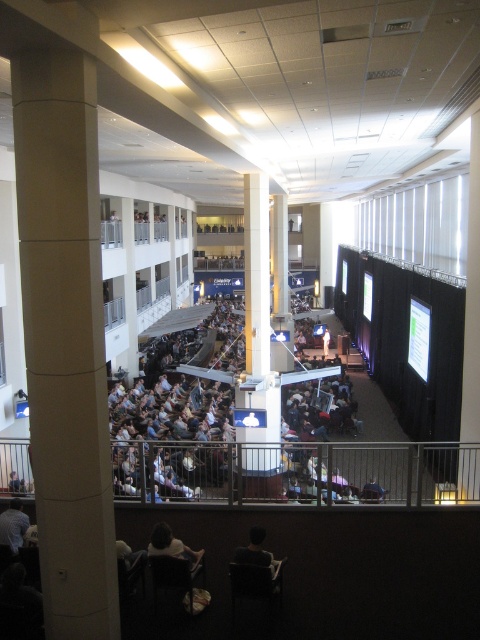
Question: Can you confirm if dark gray fabric crowd at center is positioned to the right of dark brown leather chair at lower center?

Choices:
 (A) no
 (B) yes

Answer: (A)

Question: Which object is farther from the camera taking this photo?

Choices:
 (A) light brown fabric shirt at lower left
 (B) dark brown hair at lower center

Answer: (A)

Question: Is dark gray fabric crowd at center smaller than dark brown hair at lower center?

Choices:
 (A) no
 (B) yes

Answer: (A)

Question: Based on their relative distances, which object is nearer to the dark gray fabric crowd at center?

Choices:
 (A) white concrete column at center
 (B) dark brown leather chair at lower center
 (C) dark brown hair at lower center

Answer: (B)

Question: Is light brown fabric shirt at lower left smaller than dark brown leather chair at lower center?

Choices:
 (A) no
 (B) yes

Answer: (A)

Question: Based on their relative distances, which object is nearer to the dark brown hair at lower center?

Choices:
 (A) dark brown leather chair at lower center
 (B) dark gray fabric crowd at center

Answer: (A)